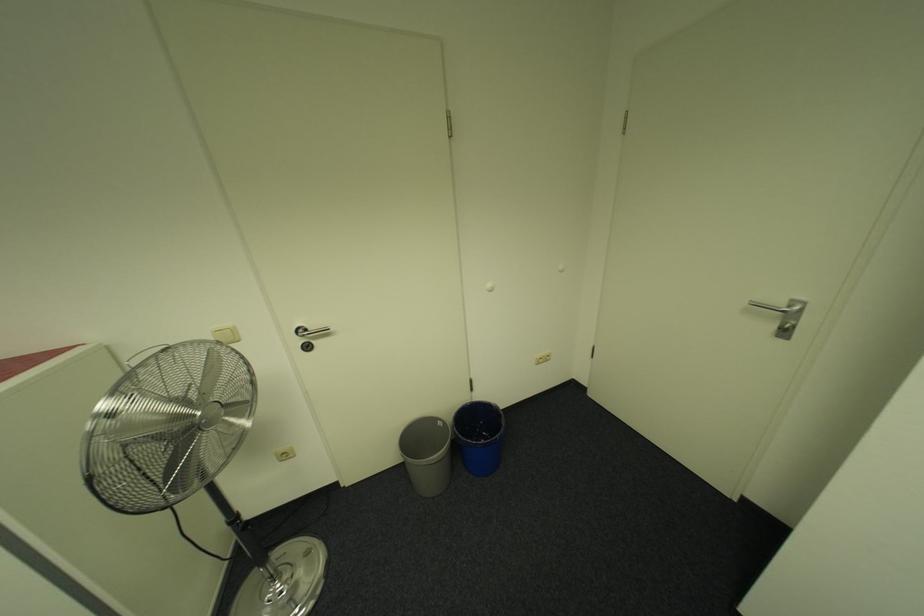
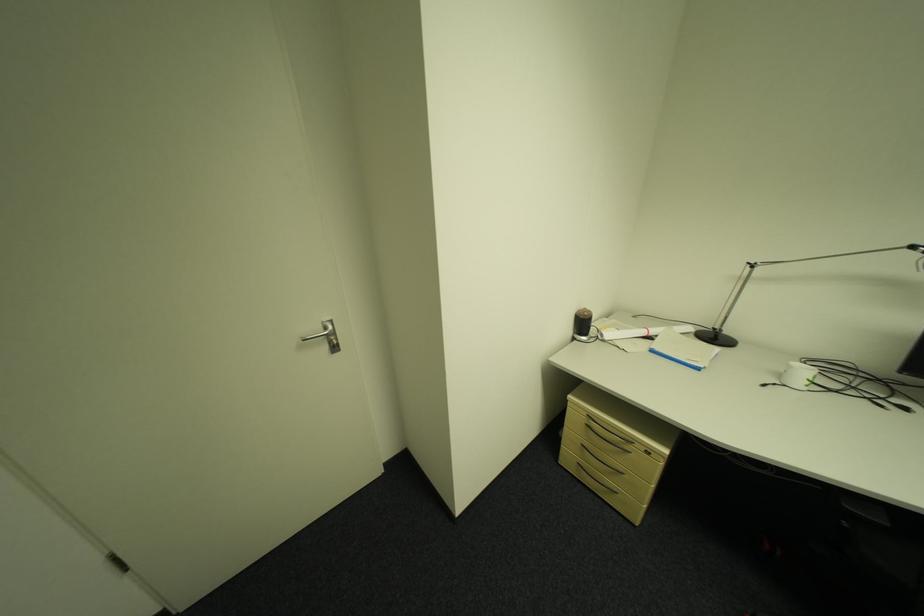
Where in the second image is the point corresponding to the point at 784,328 from the first image?

(335, 349)